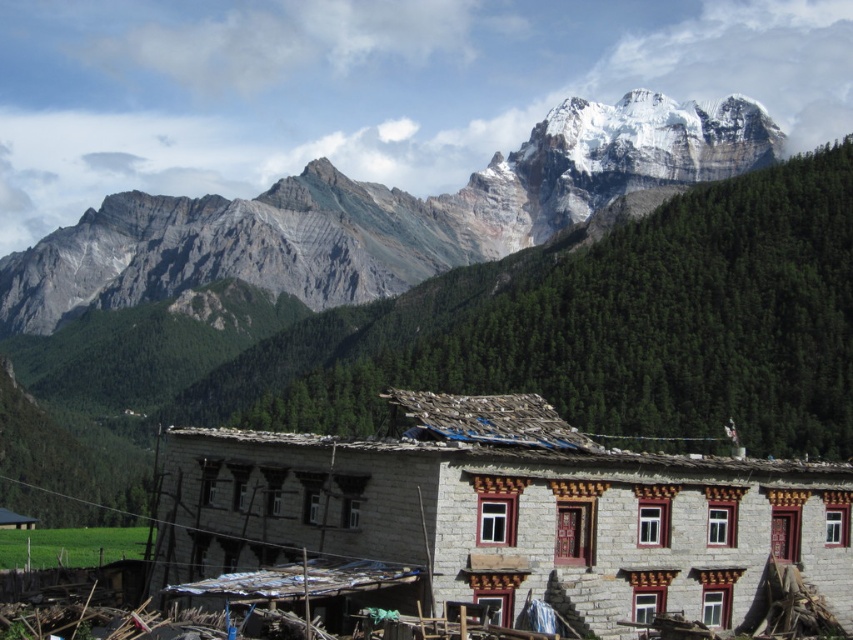
Is point (392, 552) more distant than point (27, 321)?

No, it is in front of (27, 321).

Can you confirm if white stone building at center is positioned to the left of gray rocky mountain range at upper center?

No, white stone building at center is not to the left of gray rocky mountain range at upper center.

Locate an element on the screen. This screenshot has height=640, width=853. white stone building at center is located at coordinates (496, 522).

Can you confirm if gray rocky mountain range at upper center is wider than rustic wooden hut at lower left?

Yes.

Is point (619, 108) farther from viewer compared to point (3, 512)?

Yes, it is behind point (3, 512).

Identify the location of gray rocky mountain range at upper center. The width and height of the screenshot is (853, 640). (380, 214).

What do you see at coordinates (496, 522) in the screenshot?
I see `white stone building at center` at bounding box center [496, 522].

Who is taller, white stone building at center or rustic wooden hut at lower left?

With more height is white stone building at center.

Who is more distant from viewer, (650,600) or (18,525)?

The point (18,525) is behind.

At what (x,y) coordinates should I click in order to perform the action: click on white stone building at center. Please return your answer as a coordinate pair (x, y). Looking at the image, I should click on (496, 522).